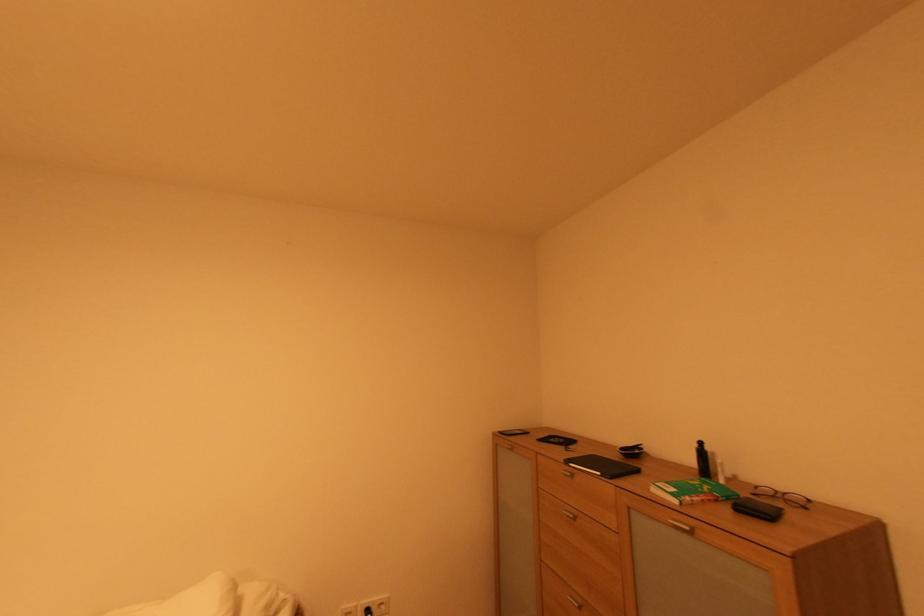
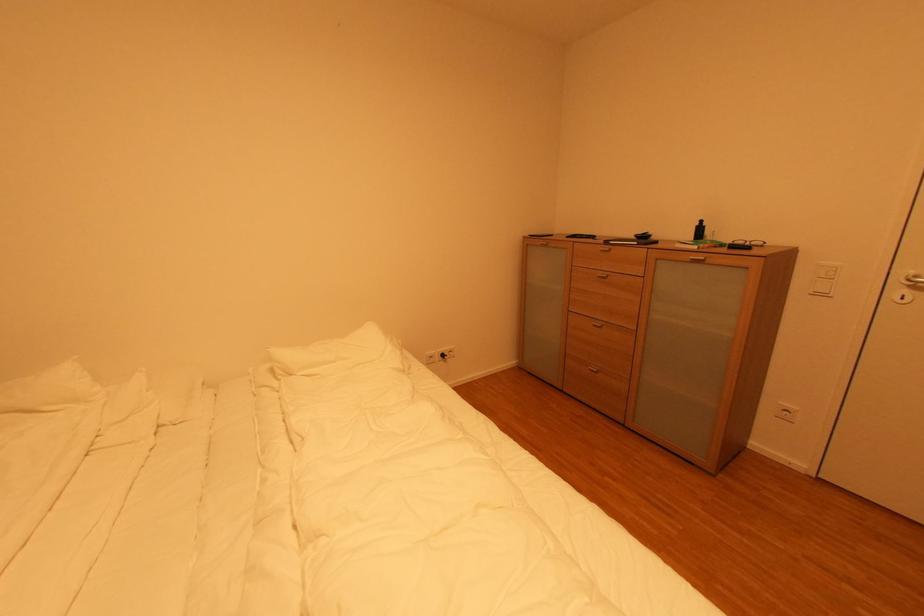
Question: The first image is from the beginning of the video and the second image is from the end. How did the camera likely rotate when shooting the video?

Choices:
 (A) Left
 (B) Right
 (C) Up
 (D) Down

Answer: (D)